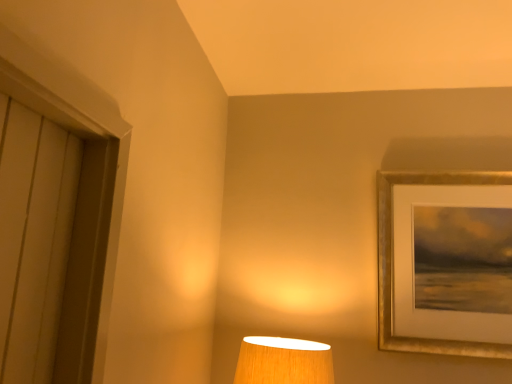
Question: Should I look upward or downward to see gold-framed picture at upper right?

Choices:
 (A) up
 (B) down

Answer: (B)